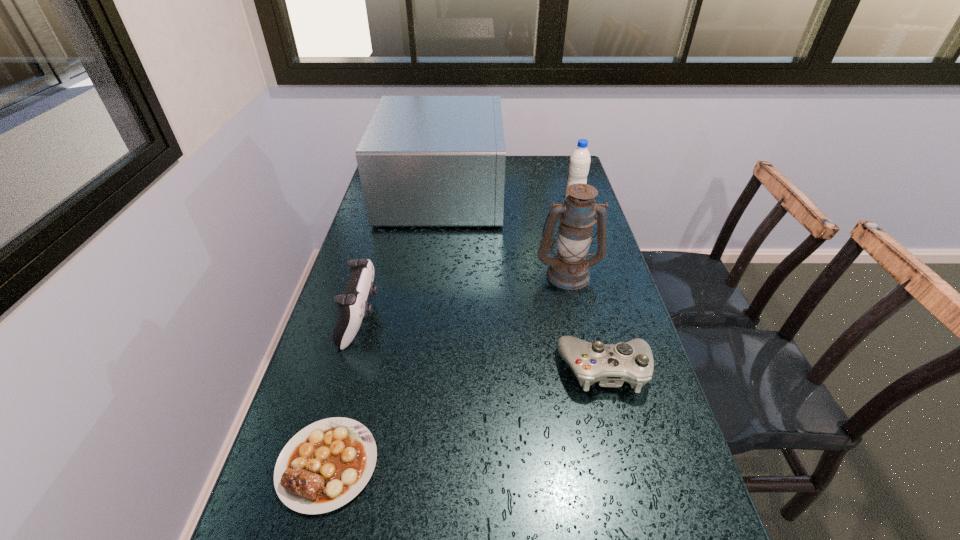
Find the location of a particular element. The height and width of the screenshot is (540, 960). water bottle present at the right edge is located at coordinates (579, 164).

This screenshot has height=540, width=960. In order to click on control present at the right edge in this screenshot , I will do `click(610, 365)`.

Where is `object at the far left corner`? The image size is (960, 540). object at the far left corner is located at coordinates (423, 160).

This screenshot has height=540, width=960. I want to click on vacant space at the left edge of the desktop, so click(286, 429).

Where is `free space at the right edge of the desktop`? Image resolution: width=960 pixels, height=540 pixels. free space at the right edge of the desktop is located at coordinates (670, 530).

At what (x,y) coordinates should I click in order to perform the action: click on blank space at the far right corner. Please return your answer as a coordinate pair (x, y). This screenshot has height=540, width=960. Looking at the image, I should click on (563, 168).

Identify the location of free space between the oil lamp and the nearest object. (447, 369).

Where is `vacant space that is in between the microwave oven and the right control`? vacant space that is in between the microwave oven and the right control is located at coordinates [x=524, y=281].

Identify the location of free space between the oil lamp and the nearest object. Image resolution: width=960 pixels, height=540 pixels. (447, 369).

The image size is (960, 540). I want to click on empty space that is in between the fourth shortest object and the second shortest object, so click(x=589, y=286).